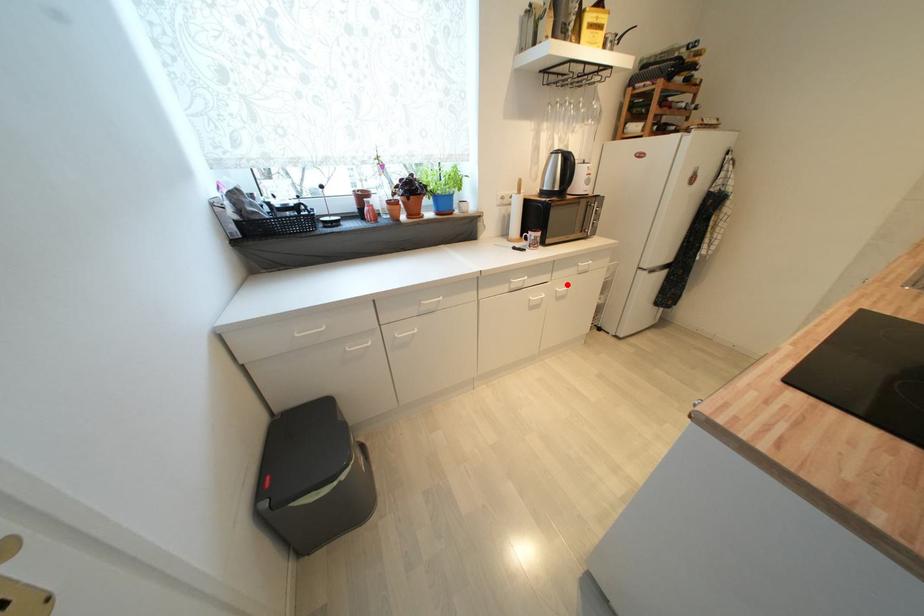
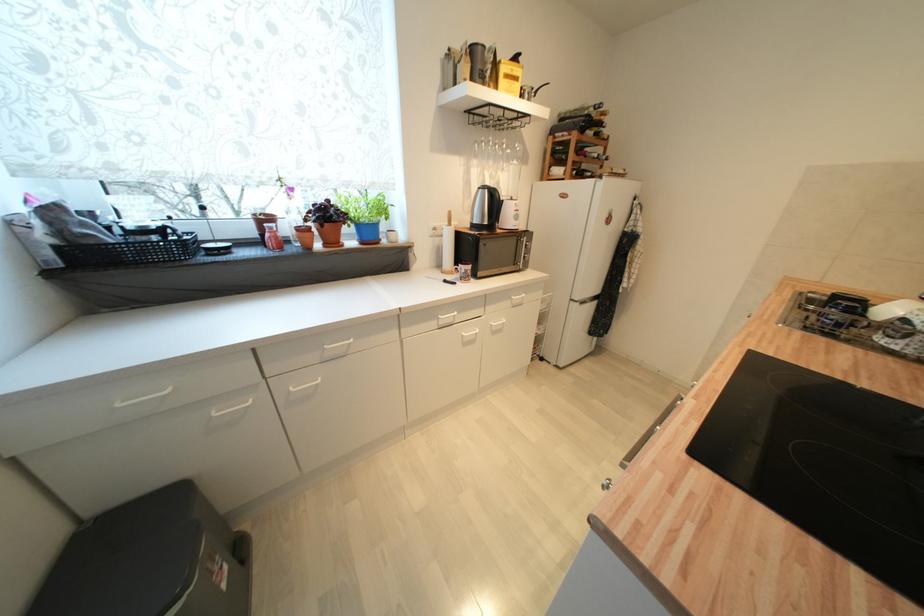
In the second image, find the point that corresponds to the highlighted location in the first image.

(502, 318)